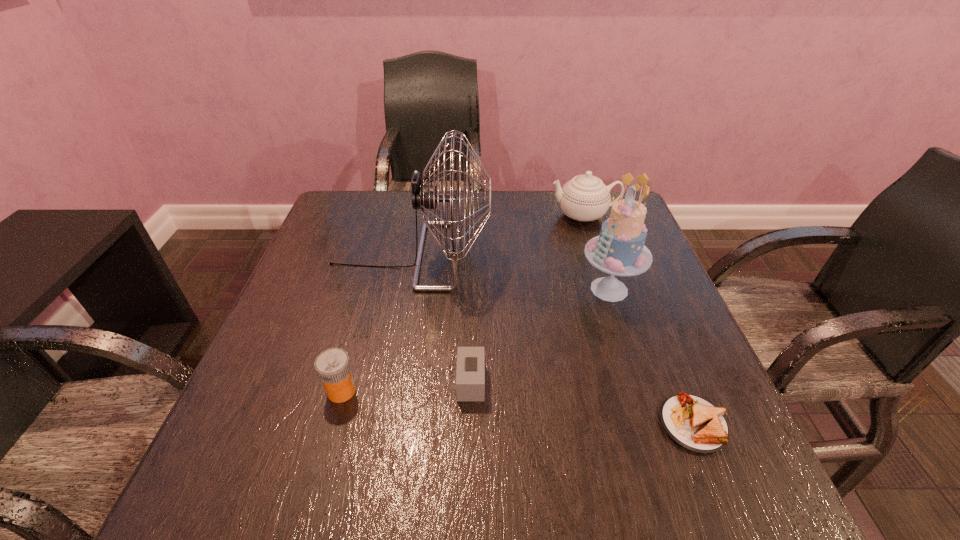
Find the location of a particular element. Image resolution: width=960 pixels, height=540 pixels. vacant space at the near right corner of the desktop is located at coordinates (702, 488).

Locate an element on the screen. The height and width of the screenshot is (540, 960). free spot between the medicine and the fan is located at coordinates (376, 323).

Identify the location of vacant area that lies between the fourth shortest object and the medicine. Image resolution: width=960 pixels, height=540 pixels. (463, 303).

Image resolution: width=960 pixels, height=540 pixels. What are the coordinates of `free point between the second shortest object and the fourth tallest object` in the screenshot? It's located at (406, 387).

The height and width of the screenshot is (540, 960). I want to click on vacant space that is in between the fan and the third tallest object, so [497, 235].

Locate an element on the screen. vacant space that is in between the alarm clock and the third tallest object is located at coordinates (527, 299).

Image resolution: width=960 pixels, height=540 pixels. Identify the location of free spot between the fourth tallest object and the chinaware. (463, 303).

This screenshot has height=540, width=960. Identify the location of free point between the sandwich and the medicine. (517, 408).

The width and height of the screenshot is (960, 540). I want to click on vacant area that lies between the alarm clock and the cake, so click(540, 336).

Locate an element on the screen. the second closest object to the chinaware is located at coordinates (425, 196).